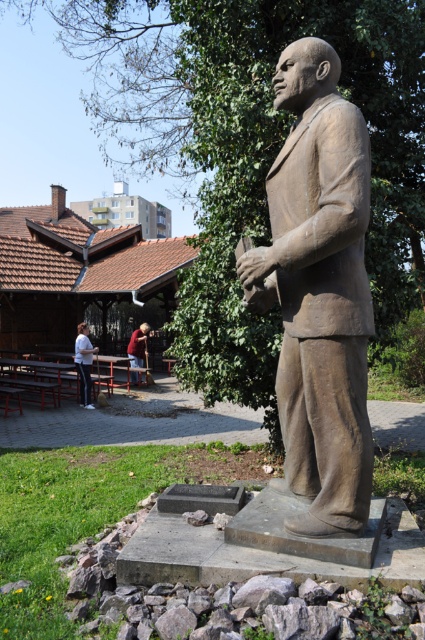
Which is below, bronze statue at center or red shirt at lower left?

red shirt at lower left is lower down.

Does bronze statue at center appear over red shirt at lower left?

Indeed, bronze statue at center is positioned over red shirt at lower left.

You are a GUI agent. You are given a task and a screenshot of the screen. Output one action in this format:
    pyautogui.click(x=<x>, y=<y>)
    Task: Click on the bronze statue at center
    
    Given the screenshot: What is the action you would take?
    pyautogui.click(x=319, y=291)

Between bronze statue at center and white matte shirt at lower left, which one is positioned higher?

bronze statue at center is higher up.

Is bronze statue at center smaller than white matte shirt at lower left?

No, bronze statue at center is not smaller than white matte shirt at lower left.

The image size is (425, 640). Identify the location of bronze statue at center. (319, 291).

Who is taller, white matte shirt at lower left or red shirt at lower left?

Standing taller between the two is white matte shirt at lower left.

Is white matte shirt at lower left to the right of red shirt at lower left from the viewer's perspective?

Incorrect, white matte shirt at lower left is not on the right side of red shirt at lower left.

At what (x,y) coordinates should I click in order to perform the action: click on white matte shirt at lower left. Please return your answer as a coordinate pair (x, y). The height and width of the screenshot is (640, 425). Looking at the image, I should click on (84, 362).

Where is `white matte shirt at lower left`? Image resolution: width=425 pixels, height=640 pixels. white matte shirt at lower left is located at coordinates (84, 362).